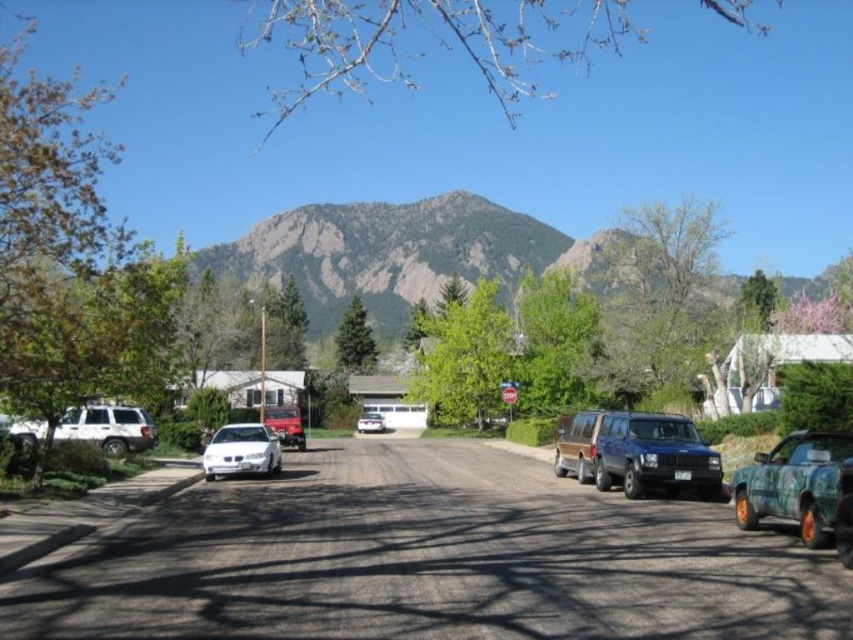
You are a delivery person with a 2.5 meter wide truck. You need to park your truck on this suburban street where the camouflage paint truck at lower right and white matte suv at left are already parked. Can your truck fit between them without overlapping?

The camouflage paint truck at lower right has a lesser width compared to white matte suv at left. Since the camouflage paint truck at lower right is narrower than the white matte suv at left, the total space between them may vary depending on their positioning. However, the width of your truck is 2.5 meters. Without knowing the exact distance between the two parked vehicles, it is impossible to determine if there is sufficient space for your truck to fit between them without overlapping.

You are a delivery driver who needs to back out of a parking spot between the white matte suv at left and the teal pickup truck at right. The parking space is 2.5 meters wide. Can your 2.3 meter wide delivery van fit between them?

The parking space between the white matte suv at left and the teal pickup truck at right is 16.50 meters wide. Since the delivery van is only 2.3 meters wide, it can easily fit within the available space.

You are standing at the point labeled as point [639,452] in the image. What object are you directly facing?

The point [639,452] indicates the matte blue suv at center, so you are directly facing the matte blue suv at center.